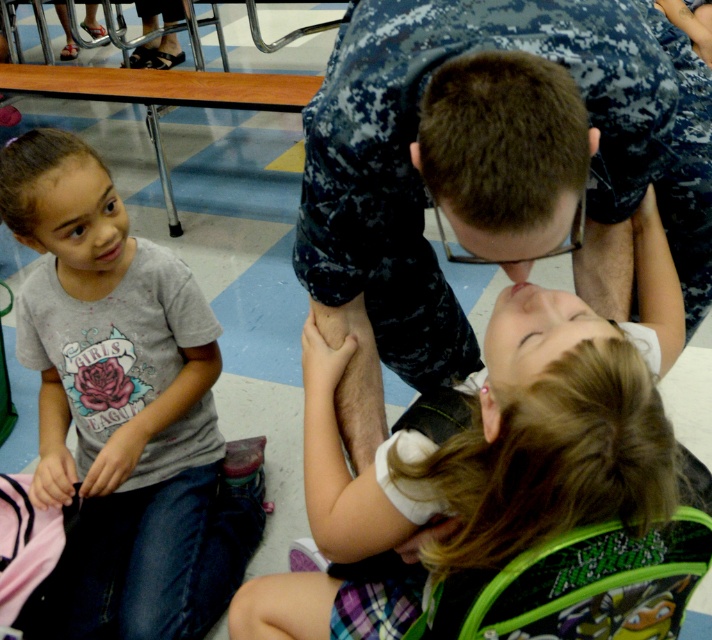
Question: Which object appears closest to the camera in this image?

Choices:
 (A) gray cotton shirt at lower left
 (B) camouflage uniform at center

Answer: (B)

Question: Can you confirm if camouflage uniform at center is positioned to the left of gray cotton shirt at lower left?

Choices:
 (A) no
 (B) yes

Answer: (A)

Question: Which point is farther to the camera?

Choices:
 (A) (88, 570)
 (B) (424, 19)

Answer: (A)

Question: Does camouflage uniform at center have a smaller size compared to gray cotton shirt at lower left?

Choices:
 (A) no
 (B) yes

Answer: (A)

Question: Can you confirm if camouflage uniform at center is bigger than gray cotton shirt at lower left?

Choices:
 (A) yes
 (B) no

Answer: (A)